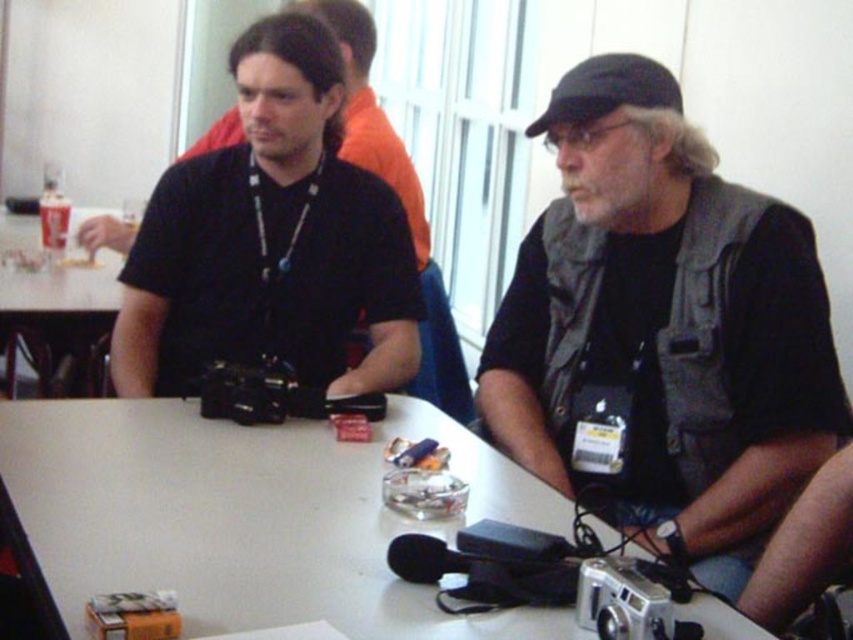
Which is more to the right, matte black camera at left or silver metallic camera at lower center?

From the viewer's perspective, silver metallic camera at lower center appears more on the right side.

Does point (310, 305) lie in front of point (584, 572)?

No, (310, 305) is further to viewer.

Where is `matte black camera at left`? The width and height of the screenshot is (853, 640). matte black camera at left is located at coordinates (271, 237).

Does point (457, 518) come closer to viewer compared to point (663, 589)?

No, (457, 518) is behind (663, 589).

Between point (96, 490) and point (647, 627), which one is positioned in front?

Point (647, 627)

The height and width of the screenshot is (640, 853). I want to click on white matte table at center, so click(245, 516).

Does white matte table at center have a larger size compared to matte black camera at left?

Yes, white matte table at center is bigger than matte black camera at left.

Does white matte table at center have a lesser width compared to matte black camera at left?

No.

Which is behind, point (236, 536) or point (310, 138)?

The point (310, 138) is behind.

Locate an element on the screen. This screenshot has height=640, width=853. white matte table at center is located at coordinates coord(245,516).